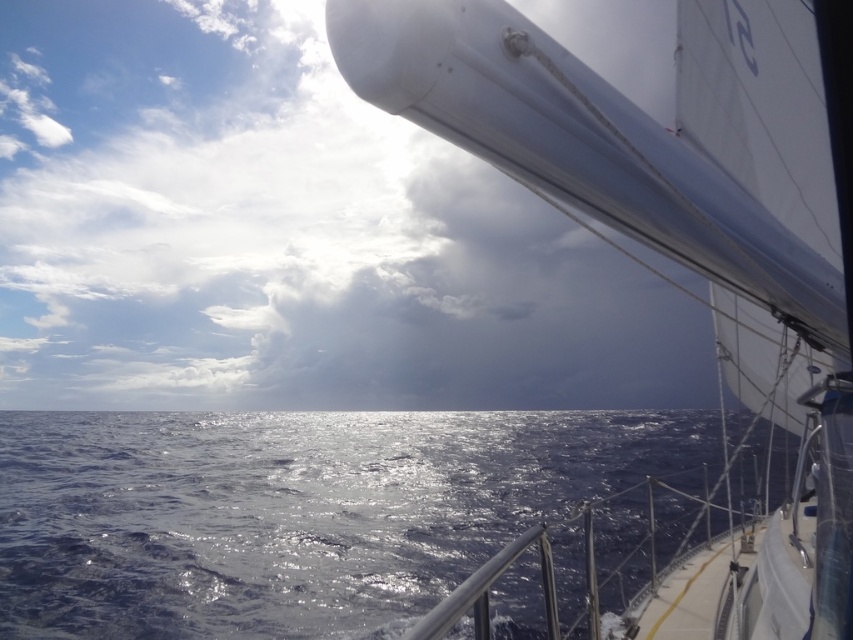
Can you confirm if white glossy sailboat at upper right is wider than glistening blue water at center?

No, white glossy sailboat at upper right is not wider than glistening blue water at center.

Is point (791, 221) closer to viewer compared to point (155, 570)?

That is True.

Image resolution: width=853 pixels, height=640 pixels. I want to click on white glossy sailboat at upper right, so click(x=677, y=236).

The height and width of the screenshot is (640, 853). Identify the location of white glossy sailboat at upper right. (677, 236).